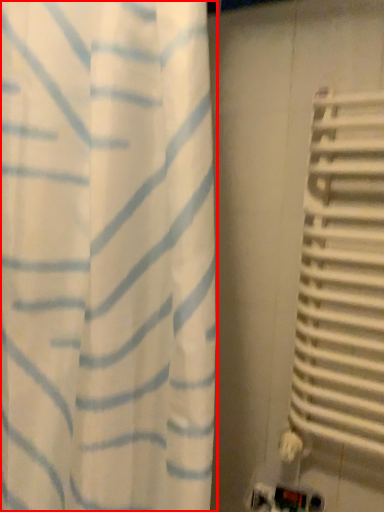
Question: From the image's perspective, what is the correct spatial relationship of curtain (annotated by the red box) in relation to blind?

Choices:
 (A) above
 (B) below

Answer: (B)